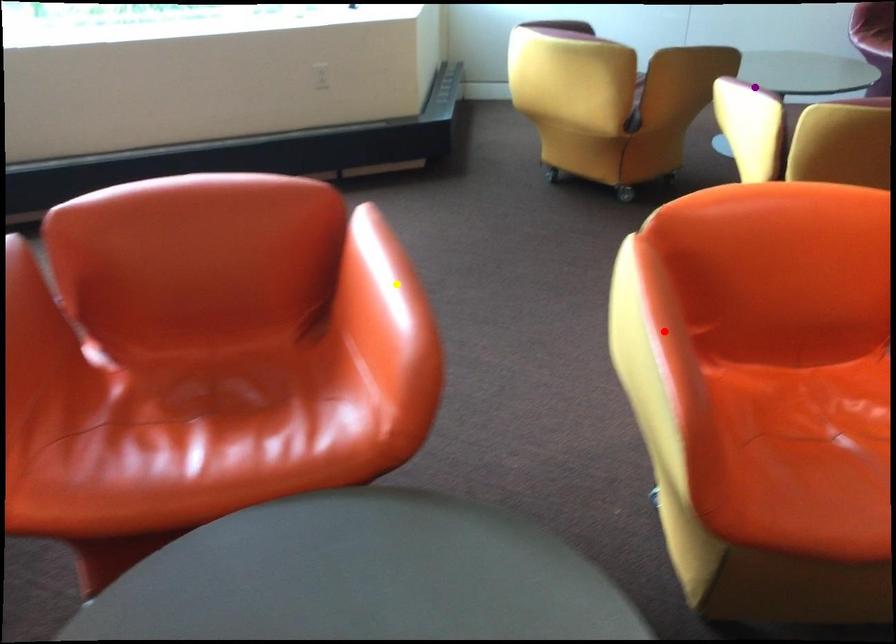
Order these from nearest to farthest:
A) yellow point
B) red point
C) purple point

red point < yellow point < purple point